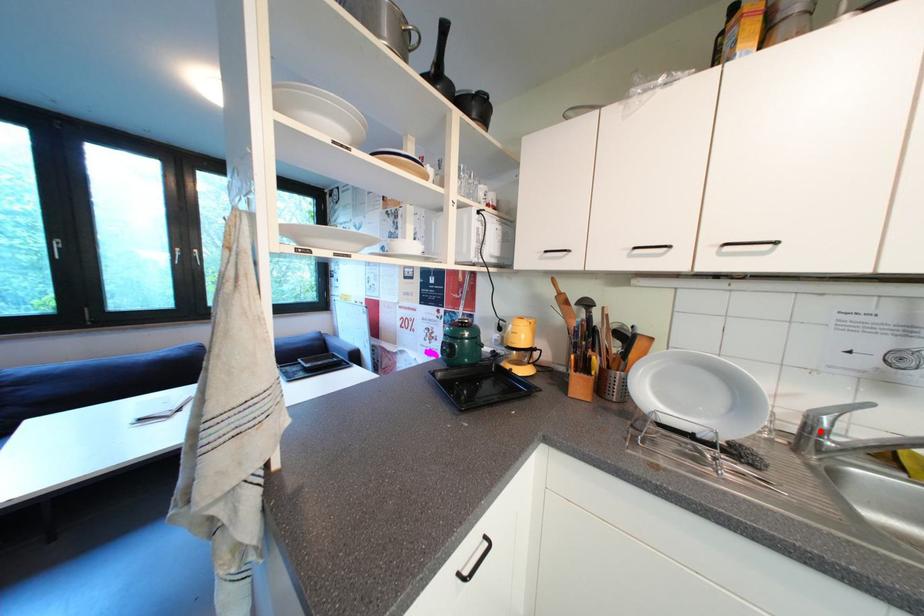
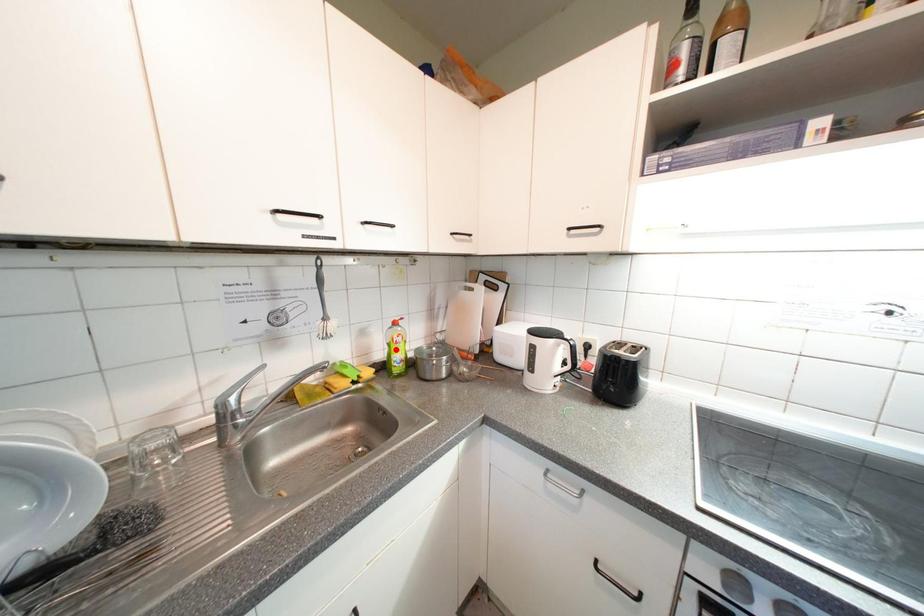
Looking at this image, I am providing you with two images of the same scene from different viewpoints. A red point is marked on the first image and another point is marked on the second image. Is the red point in image1 aligned with the point shown in image2?

No